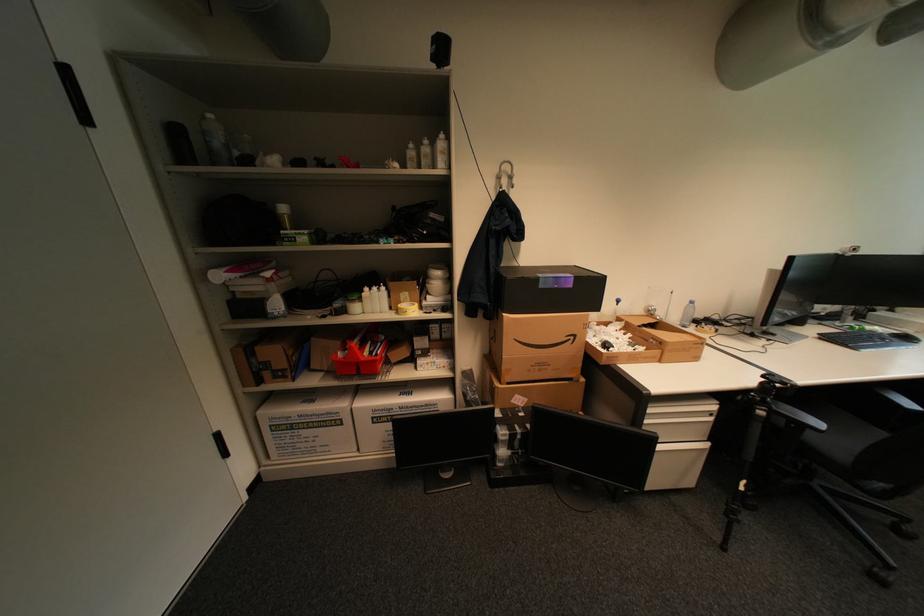
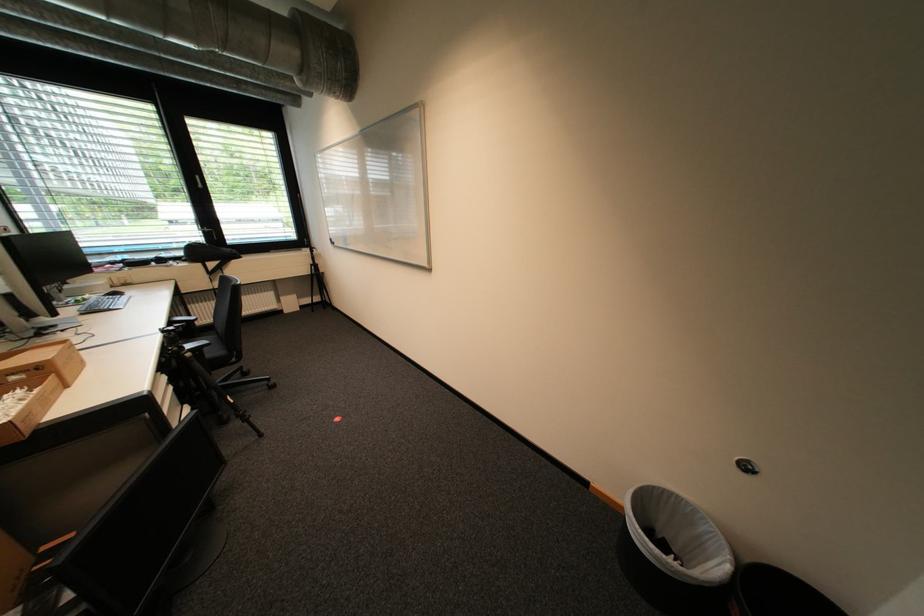
In the second image, find the point that corresponds to [816,431] in the first image.

(213, 350)